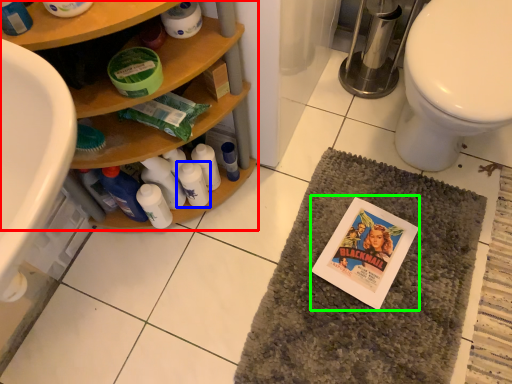
Question: Estimate the real-world distances between objects in this image. Which object is farther from bathroom cabinet (highlighted by a red box), toiletry (highlighted by a blue box) or comic book (highlighted by a green box)?

Choices:
 (A) toiletry
 (B) comic book

Answer: (B)